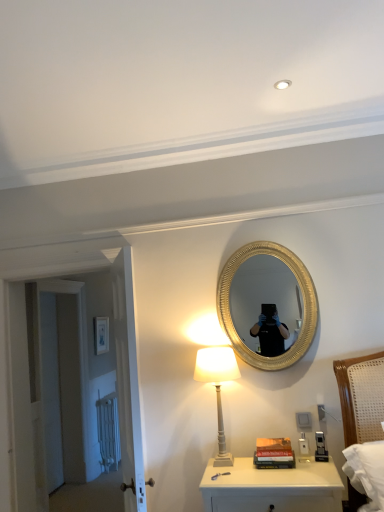
Identify the location of vacant position to the left of hardcover books at center. The height and width of the screenshot is (512, 384). (247, 466).